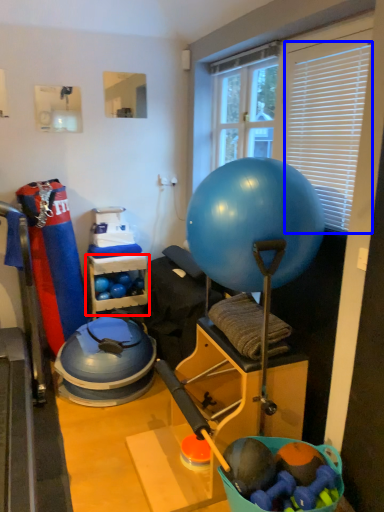
Question: Which point is further to the camera, shelf (highlighted by a red box) or blind (highlighted by a blue box)?

Choices:
 (A) shelf
 (B) blind

Answer: (A)